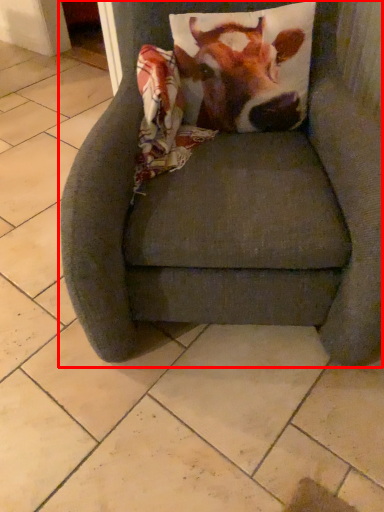
Question: Where is chair (annotated by the red box) located in relation to cattle in the image?

Choices:
 (A) left
 (B) right

Answer: (A)